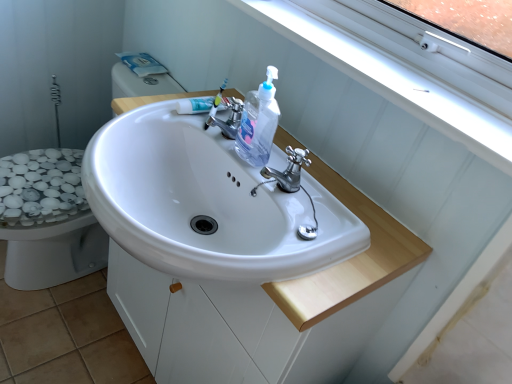
You are a GUI agent. You are given a task and a screenshot of the screen. Output one action in this format:
    pyautogui.click(x=<x>, y=<y>)
    Task: Click on the vacant space that is to the left of chrome metallic faucet at center, marked as the first tap in a left-to-right arrangement
    
    Given the screenshot: What is the action you would take?
    pyautogui.click(x=164, y=114)